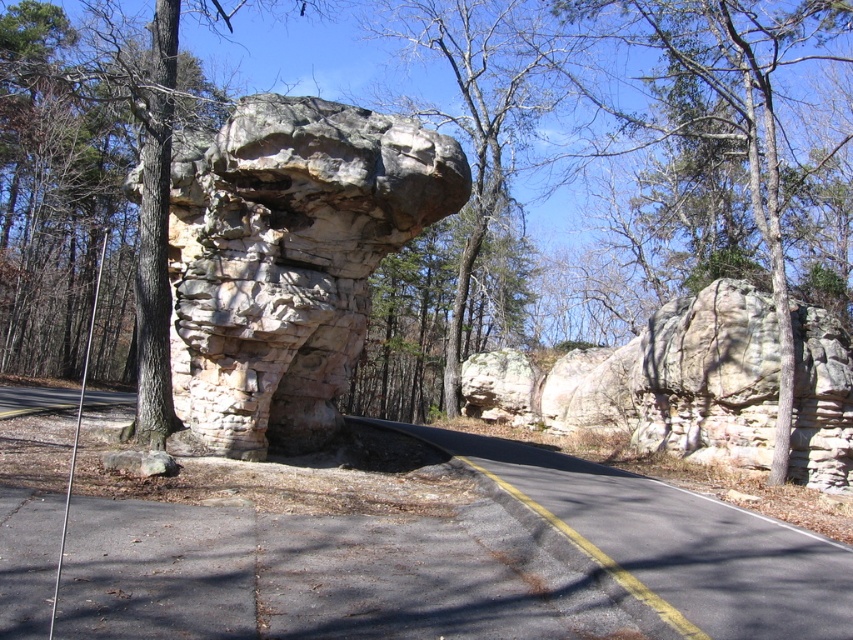
Question: In this image, where is gray stone arch at center located relative to rustic stone arch at center?

Choices:
 (A) below
 (B) above

Answer: (B)

Question: Is gray stone arch at center in front of rustic stone arch at center?

Choices:
 (A) yes
 (B) no

Answer: (A)

Question: Which object appears closest to the camera in this image?

Choices:
 (A) gray stone arch at center
 (B) rustic stone arch at center

Answer: (A)

Question: Does gray stone arch at center lie in front of rustic stone arch at center?

Choices:
 (A) no
 (B) yes

Answer: (B)

Question: Which point is farther from the camera taking this photo?

Choices:
 (A) (325, 108)
 (B) (520, 384)

Answer: (B)